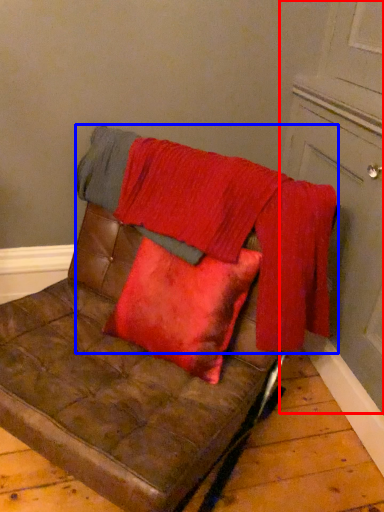
Question: Which object appears closest to the camera in this image, door (highlighted by a red box) or blanket (highlighted by a blue box)?

Choices:
 (A) door
 (B) blanket

Answer: (A)